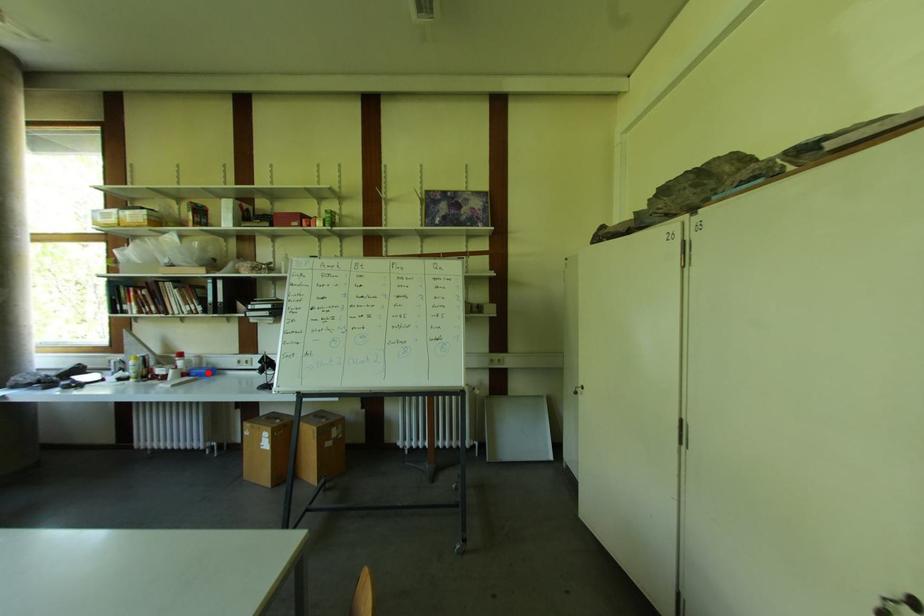
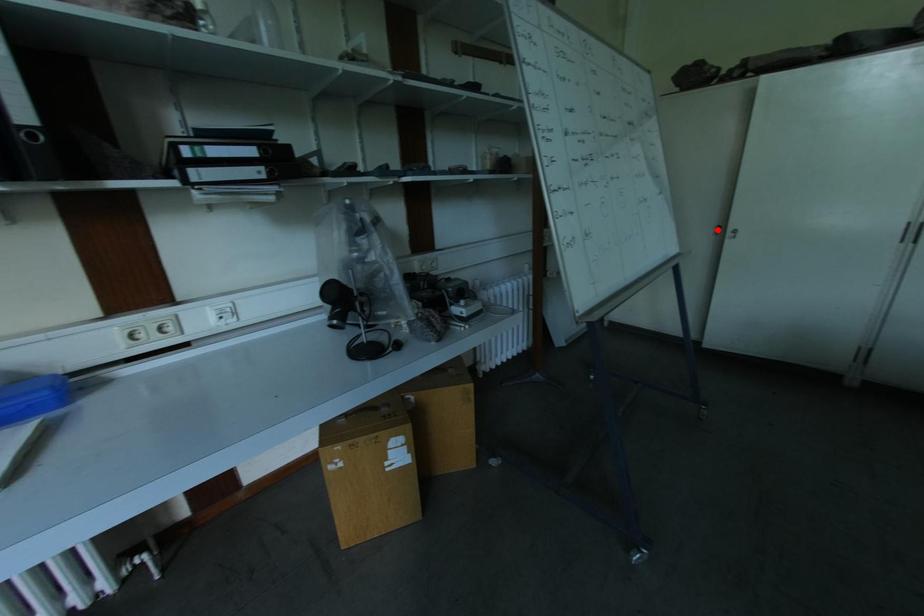
I am providing you with two images of the same scene from different viewpoints. A red point is marked on the first image and another point is marked on the second image. Do the highlighted points in image1 and image2 indicate the same real-world spot?

No